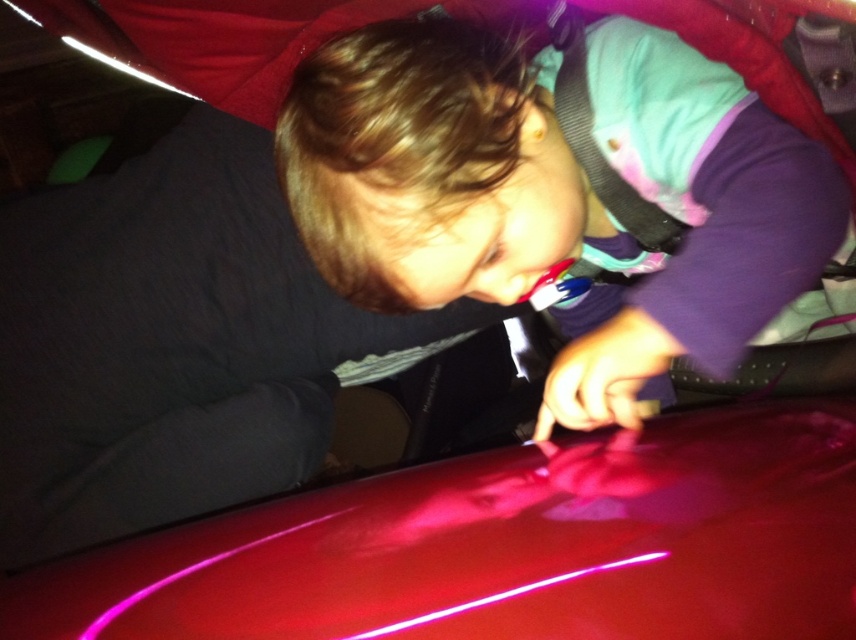
You are a photographer setting up a shoot. You have a matte purple shirt at center and a glossy red car at center in your frame. Based on the scene, which object is taller?

The matte purple shirt at center is taller than the glossy red car at center.

You are an AI analyzing the image. The scene has a child near a red surface. Where exactly is the matte purple shirt at center located in terms of coordinates?

The matte purple shirt at center is located at coordinates point (557,195).

You are a photographer setting up a shoot. You need to position a light source to highlight both the matte purple shirt at center and the glossy red car at center. Given their sizes, which object should you place closer to the camera to ensure both are equally visible in the frame?

The matte purple shirt at center has a lesser width compared to glossy red car at center, so to make both equally visible, place the matte purple shirt at center closer to the camera.